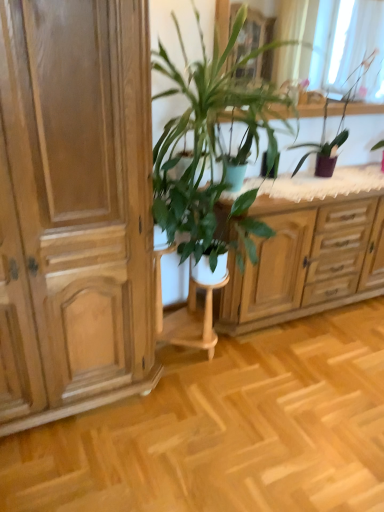
The image size is (384, 512). Identify the location of vacant space in front of light brown wood cabinet at left. (95, 462).